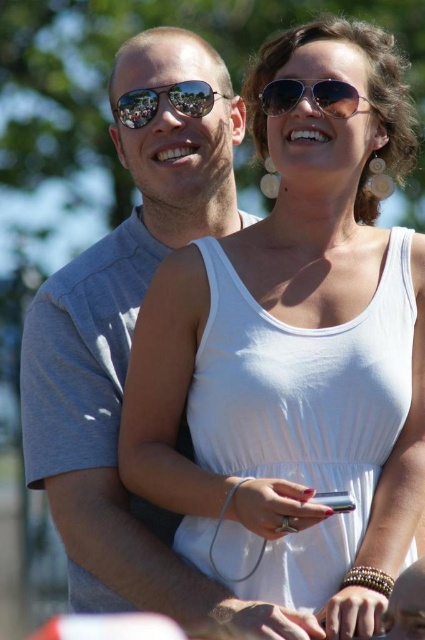
You are standing in a public event and see two people. The first person is holding a small electronic device in their right hand and has red nails. The second person is wearing sunglasses and their head is tilted towards the first person. There is a point at coordinates point (167, 100). Where is this point located?

The point (167, 100) is located on the shiny reflective sunglasses at upper center of the second person.

You are a fashion designer observing the scene. You need to determine if the white fabric dress at center can be paired with the metallic silver phone at lower center in terms of size. Can the phone be easily carried in the dress pockets?

The white fabric dress at center has a larger size compared to metallic silver phone at lower center. Therefore, the metallic silver phone at lower center can likely fit into the dress pockets if they are appropriately sized for the phone.

Looking at this image, you are a photographer trying to capture a photo of the two people in the scene. The white fabric dress at center and the metallic silver phone at lower center are both in your frame. Which object will appear larger in your photo?

The white fabric dress at center will appear larger in the photo because it is taller than the metallic silver phone at lower center.